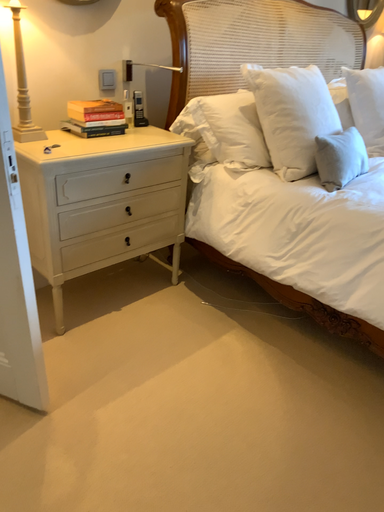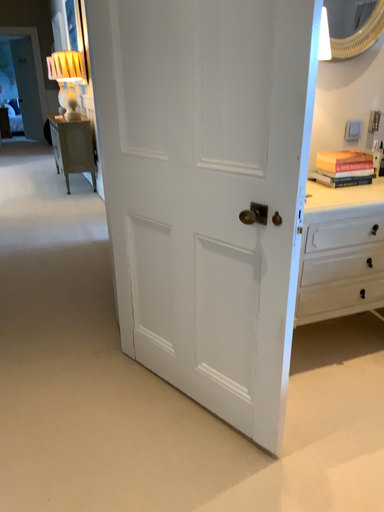
Question: How did the camera likely rotate when shooting the video?

Choices:
 (A) rotated downward
 (B) rotated upward

Answer: (B)